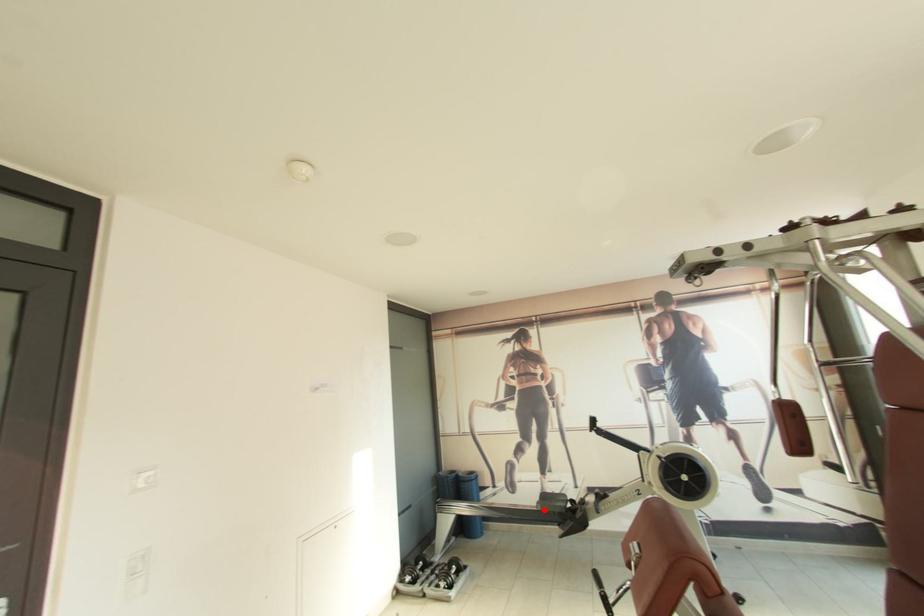
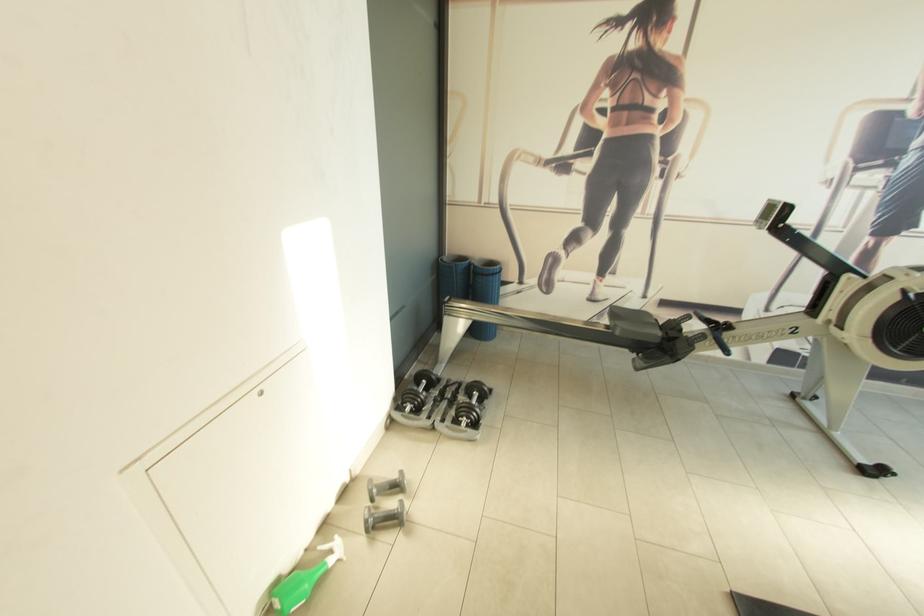
Where in the second image is the point corresponding to the highlighted location from the first image?

(622, 334)